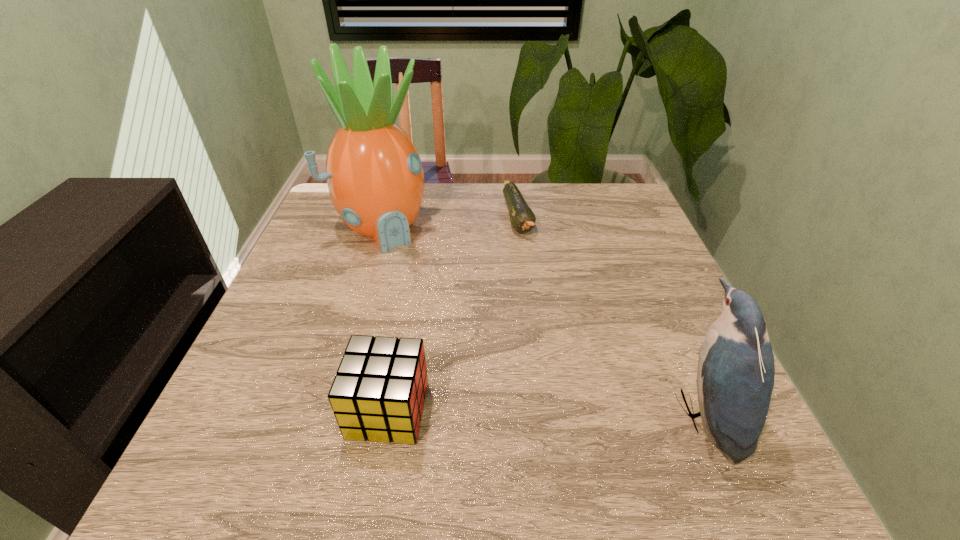
Where is `cube`? cube is located at coordinates pos(378,393).

At what (x,y) coordinates should I click in order to perform the action: click on the rightmost object. Please return your answer as a coordinate pair (x, y). The width and height of the screenshot is (960, 540). Looking at the image, I should click on (735, 378).

The width and height of the screenshot is (960, 540). I want to click on the second tallest object, so click(735, 378).

The height and width of the screenshot is (540, 960). I want to click on pineapple, so click(374, 174).

Identify the location of zucchini. 522,218.

Identify the location of the shortest object. (522, 218).

At what (x,y) coordinates should I click in order to perform the action: click on free region located 0.070m on the right of the second shortest object. Please return your answer as a coordinate pair (x, y). The width and height of the screenshot is (960, 540). Looking at the image, I should click on (466, 410).

Where is `vacant point located at the tip of the bird's beak`? This screenshot has width=960, height=540. vacant point located at the tip of the bird's beak is located at coordinates click(540, 413).

You are a GUI agent. You are given a task and a screenshot of the screen. Output one action in this format:
    pyautogui.click(x=<x>, y=<y>)
    Task: Click on the free space located 0.380m at the tip of the bird's beak
    Image resolution: width=960 pixels, height=540 pixels.
    Given the screenshot: What is the action you would take?
    pyautogui.click(x=460, y=413)

The height and width of the screenshot is (540, 960). I want to click on free space located 0.190m at the tip of the bird's beak, so click(x=568, y=413).